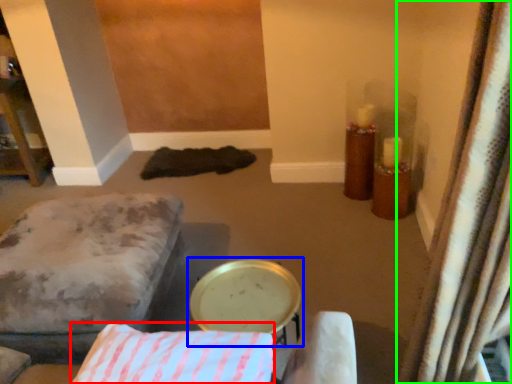
Question: Which object is the closest to the pillow (highlighted by a red box)? Choose among these: round table (highlighted by a blue box) or curtain (highlighted by a green box).

Choices:
 (A) round table
 (B) curtain

Answer: (A)